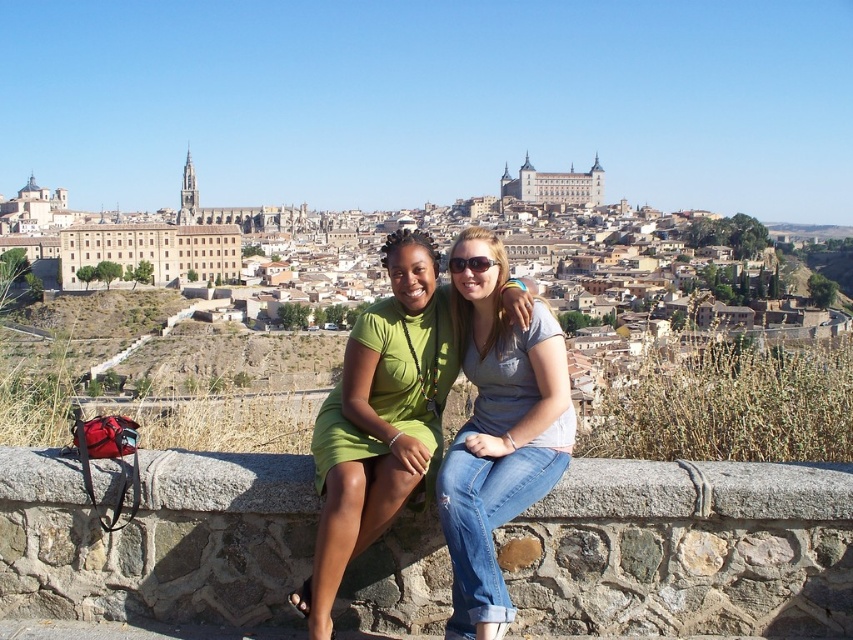
You are standing in the city park and see two people sitting on the stone ledge at center and denim jeans at center. Which object is located to the left of the other?

The stone ledge at center is positioned on the left side of denim jeans at center.

You are a photographer standing at the base of the stone wall where the green matte dress at center and denim jeans at center are sitting. You want to take a photo that includes both individuals without any part of them being cut off. What is the minimum width of the camera lens you need to capture both of them comfortably?

The green matte dress at center and denim jeans at center are 4.56 meters apart from each other. To capture both comfortably, the camera lens should have a minimum width of at least 4.56 meters to ensure neither individual is cut off.